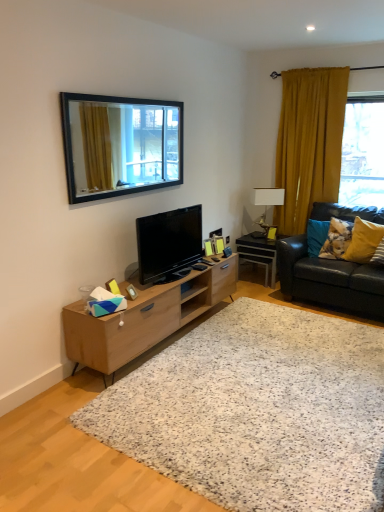
Question: Is light wood/finish tv stand at center further to camera compared to fluffy fabric pillow at right, the 2th pillow in the right-to-left sequence?

Choices:
 (A) no
 (B) yes

Answer: (A)

Question: Does light wood/finish tv stand at center appear on the left side of fluffy fabric pillow at right, the 2th pillow in the right-to-left sequence?

Choices:
 (A) no
 (B) yes

Answer: (B)

Question: Is light wood/finish tv stand at center touching fluffy fabric pillow at right, the 2th pillow in the right-to-left sequence?

Choices:
 (A) yes
 (B) no

Answer: (B)

Question: Can you confirm if light wood/finish tv stand at center is taller than fluffy fabric pillow at right, the 2th pillow in the right-to-left sequence?

Choices:
 (A) no
 (B) yes

Answer: (B)

Question: Does light wood/finish tv stand at center lie in front of fluffy fabric pillow at right, arranged as the first pillow when viewed from the left?

Choices:
 (A) yes
 (B) no

Answer: (A)

Question: Is matte black tv at center to the left or to the right of mustard velvet curtain at right in the image?

Choices:
 (A) left
 (B) right

Answer: (A)

Question: Is matte black tv at center wider or thinner than mustard velvet curtain at right?

Choices:
 (A) thin
 (B) wide

Answer: (B)

Question: Is matte black tv at center taller or shorter than mustard velvet curtain at right?

Choices:
 (A) short
 (B) tall

Answer: (A)

Question: Is matte black tv at center situated inside mustard velvet curtain at right or outside?

Choices:
 (A) outside
 (B) inside

Answer: (A)

Question: Is white ceramic lamp at right to the left or to the right of yellow fabric pillow at right, placed as the 1th pillow when sorted from right to left, in the image?

Choices:
 (A) right
 (B) left

Answer: (B)

Question: Looking at their shapes, would you say white ceramic lamp at right is wider or thinner than yellow fabric pillow at right, placed as the 1th pillow when sorted from right to left?

Choices:
 (A) thin
 (B) wide

Answer: (A)

Question: Looking at the image, does white ceramic lamp at right seem bigger or smaller compared to yellow fabric pillow at right, marked as the second pillow in a left-to-right arrangement?

Choices:
 (A) big
 (B) small

Answer: (B)

Question: Does point (264, 189) appear closer or farther from the camera than point (370, 238)?

Choices:
 (A) closer
 (B) farther

Answer: (B)

Question: Looking at the image, does transparent glass window at right seem bigger or smaller compared to fluffy fabric pillow at right, arranged as the first pillow when viewed from the left?

Choices:
 (A) big
 (B) small

Answer: (A)

Question: Looking at their shapes, would you say transparent glass window at right is wider or thinner than fluffy fabric pillow at right, arranged as the first pillow when viewed from the left?

Choices:
 (A) thin
 (B) wide

Answer: (A)